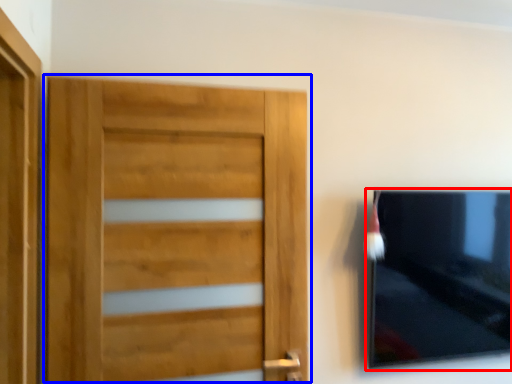
Question: Among these objects, which one is farthest to the camera, picture frame (highlighted by a red box) or door (highlighted by a blue box)?

Choices:
 (A) picture frame
 (B) door

Answer: (A)